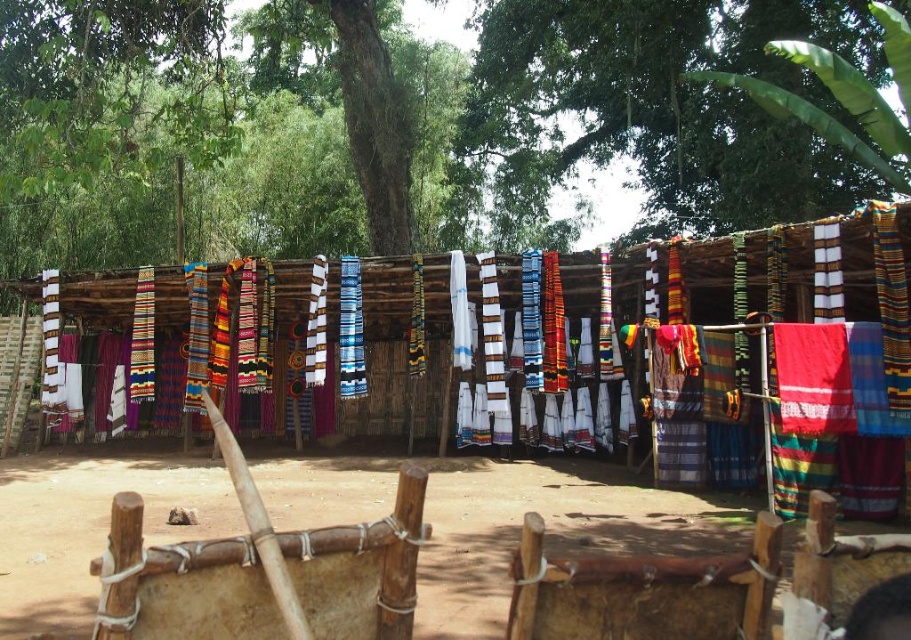
Question: Is textured woven cloth at center to the right of green leafy tree at upper center from the viewer's perspective?

Choices:
 (A) no
 (B) yes

Answer: (A)

Question: Is textured woven cloth at center smaller than brown dirt field at center?

Choices:
 (A) no
 (B) yes

Answer: (A)

Question: Among these objects, which one is farthest from the camera?

Choices:
 (A) green leafy tree at upper center
 (B) textured woven cloth at center
 (C) brown dirt field at center

Answer: (A)

Question: Which is farther from the textured woven cloth at center?

Choices:
 (A) brown dirt field at center
 (B) green leafy tree at upper center

Answer: (B)

Question: Is brown dirt field at center wider than green leafy tree at upper center?

Choices:
 (A) no
 (B) yes

Answer: (A)

Question: Estimate the real-world distances between objects in this image. Which object is closer to the brown dirt field at center?

Choices:
 (A) green leafy tree at upper center
 (B) textured woven cloth at center

Answer: (B)